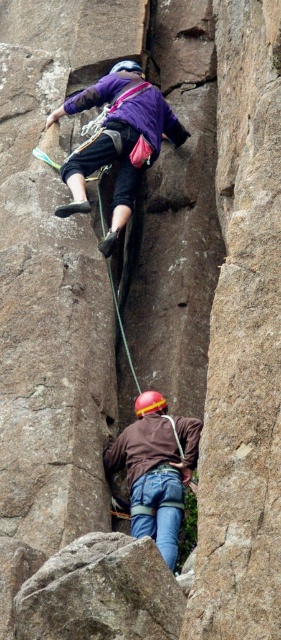
Question: Which object appears farthest from the camera in this image?

Choices:
 (A) rough textured rock at lower center
 (B) brown matte jacket at center

Answer: (B)

Question: Based on their relative distances, which object is farther from the matte purple shirt at upper center?

Choices:
 (A) brown matte jacket at center
 (B) rough textured rock at lower center

Answer: (B)

Question: Considering the relative positions of rough textured rock at lower center and brown matte jacket at center in the image provided, where is rough textured rock at lower center located with respect to brown matte jacket at center?

Choices:
 (A) below
 (B) above

Answer: (A)

Question: Is rough textured rock at lower center bigger than brown matte jacket at center?

Choices:
 (A) no
 (B) yes

Answer: (A)

Question: Which object is positioned closest to the rough textured rock at lower center?

Choices:
 (A) brown matte jacket at center
 (B) matte purple shirt at upper center

Answer: (A)

Question: Can you confirm if matte purple shirt at upper center is wider than brown matte jacket at center?

Choices:
 (A) yes
 (B) no

Answer: (A)